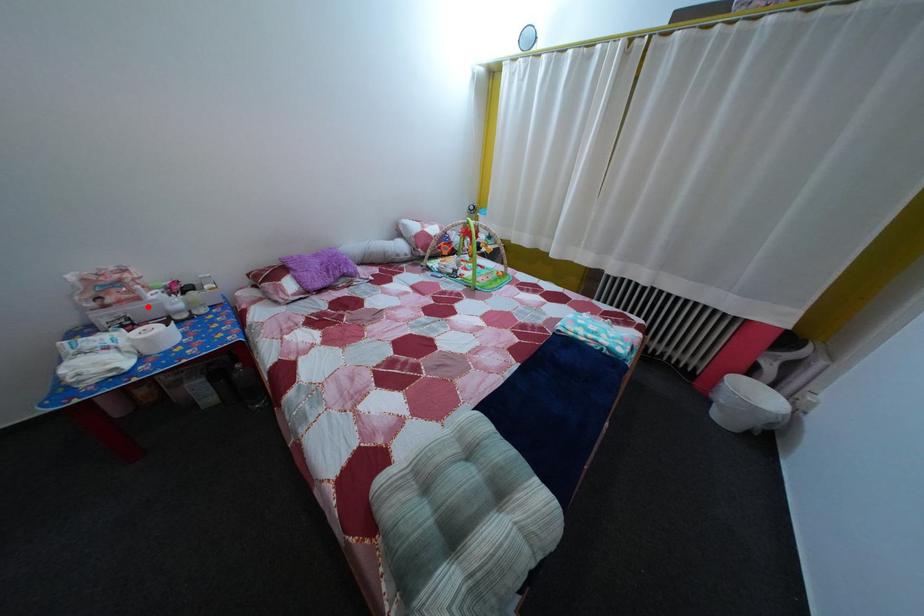
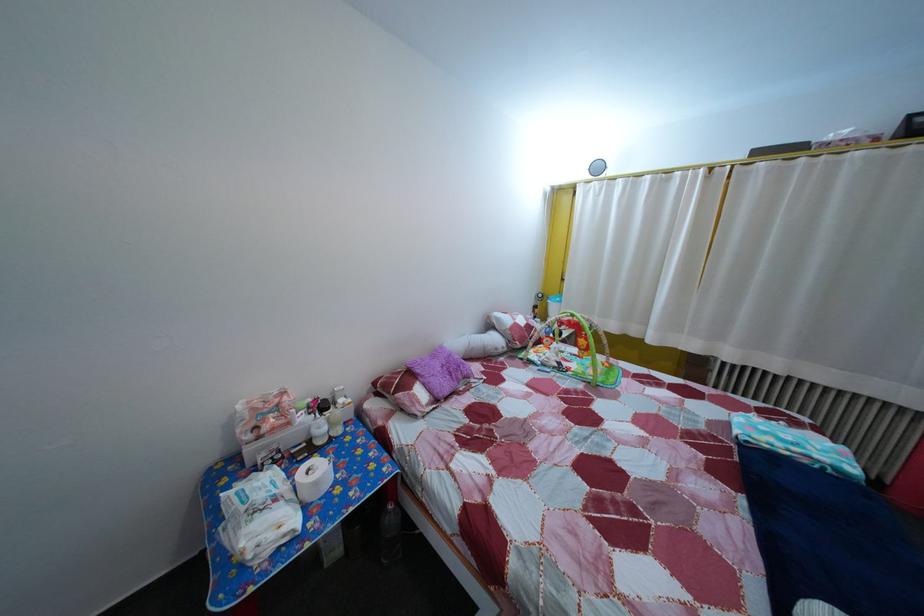
In the second image, find the point that corresponds to the highlighted location in the first image.

(298, 432)